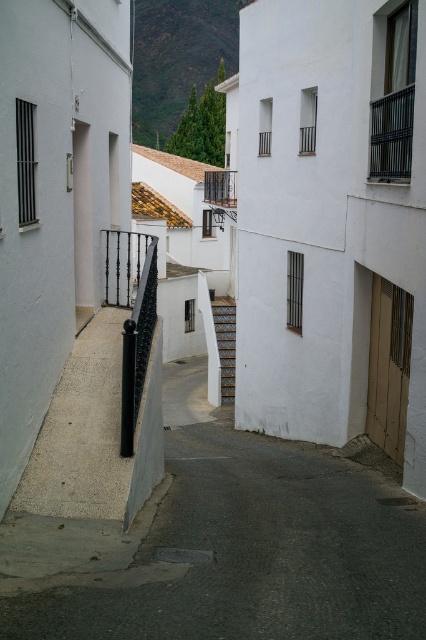
Does wooden staircase at center appear over black metal balustrade at center?

Actually, wooden staircase at center is below black metal balustrade at center.

Based on the photo, is wooden staircase at center positioned before black metal balustrade at center?

Yes.

Locate an element on the screen. The height and width of the screenshot is (640, 426). wooden staircase at center is located at coordinates (226, 342).